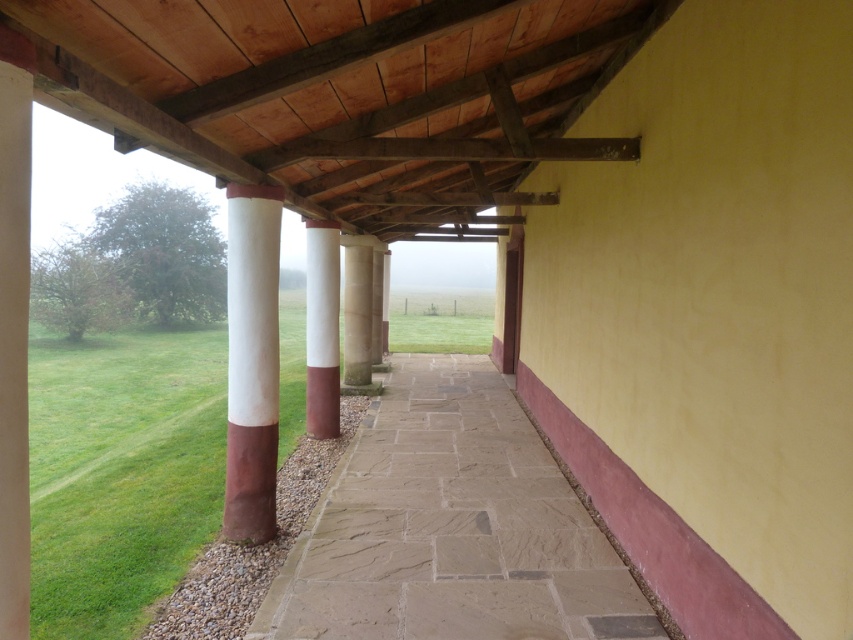
You are standing at the entrance of the walkway and want to step onto the green grass at lower left. However, you notice the white glossy column at center is in your way. Can you walk around the column to reach the grass?

The white glossy column at center is much shorter than the green grass at lower left, so you can easily walk around it to reach the grass.

In the scene shown: You are a gardener who needs to mow the green grass at lower left and the brown stone path at center. Which area requires a wider mower to cover the entire width?

The green grass at lower left requires a wider mower since the brown stone path at center has a lesser width compared to it.